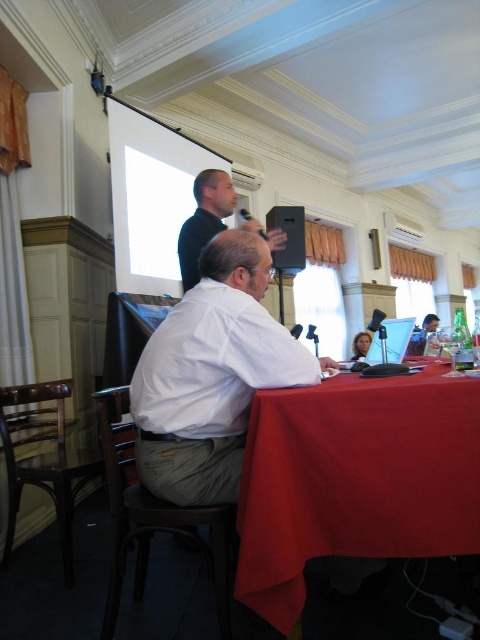
Is red cloth table at lower center positioned before white cotton shirt at center?

Yes, red cloth table at lower center is closer to the viewer.

Locate an element on the screen. The width and height of the screenshot is (480, 640). red cloth table at lower center is located at coordinates (355, 480).

Is red cloth table at lower center below black matte shirt at upper center?

Yes, red cloth table at lower center is below black matte shirt at upper center.

Is red cloth table at lower center to the left of black matte shirt at upper center from the viewer's perspective?

No, red cloth table at lower center is not to the left of black matte shirt at upper center.

You are a GUI agent. You are given a task and a screenshot of the screen. Output one action in this format:
    pyautogui.click(x=<x>, y=<y>)
    Task: Click on the red cloth table at lower center
    
    Given the screenshot: What is the action you would take?
    pyautogui.click(x=355, y=480)

Where is `white cotton shirt at center`? white cotton shirt at center is located at coordinates (212, 376).

Who is more distant from viewer, (182, 330) or (219, 170)?

The point (219, 170) is behind.

Does point (298, 365) come behind point (195, 260)?

No, (298, 365) is closer to viewer.

Find the location of `white cotton shirt at center`. white cotton shirt at center is located at coordinates (212, 376).